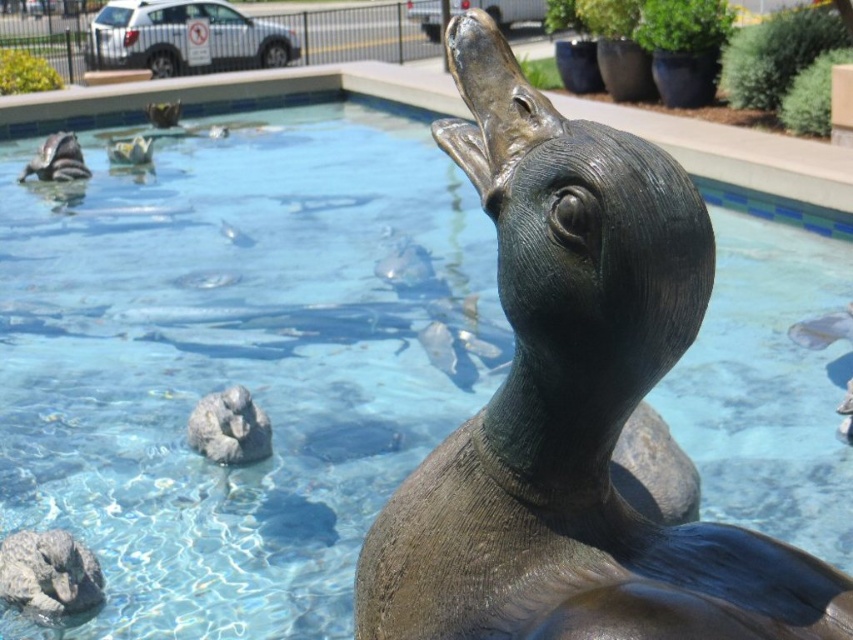
Question: Considering the relative positions of gray stone rock at lower left and matte black seal at upper left in the image provided, where is gray stone rock at lower left located with respect to matte black seal at upper left?

Choices:
 (A) below
 (B) above

Answer: (A)

Question: Is gray stone rock at center to the right of matte black seal at upper left from the viewer's perspective?

Choices:
 (A) yes
 (B) no

Answer: (A)

Question: Which object is the farthest from the gray stone rock at center?

Choices:
 (A) matte black seal at upper left
 (B) gray stone rock at lower left

Answer: (A)

Question: Which is nearer to the gray stone rock at center?

Choices:
 (A) gray stone rock at lower left
 (B) matte black seal at upper left

Answer: (A)

Question: Which of the following is the farthest from the observer?

Choices:
 (A) gray stone rock at center
 (B) gray stone rock at lower left
 (C) matte black seal at upper left

Answer: (C)

Question: Does gray stone rock at center appear on the left side of matte black seal at upper left?

Choices:
 (A) no
 (B) yes

Answer: (A)